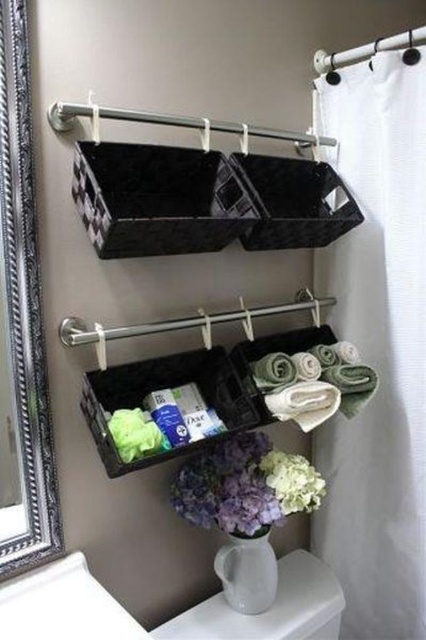
You are standing in the bathroom and want to reach the white fabric curtain at right to adjust it. However, there is a white glossy sink at lower left in your way. Which direction should you move to avoid the sink and reach the curtain?

Since the white fabric curtain at right is to the right of the white glossy sink at lower left, you should move to the right side of the sink to avoid it and reach the curtain.

You are a bathroom designer planning to install a new 30 inch wide decorative shelf between the white fabric curtain at right and the white glossy sink at lower left. Is there enough space to fit the shelf?

The distance between the white fabric curtain at right and the white glossy sink at lower left is 34.71 inches. Since the shelf is 30 inches wide, there is sufficient space to install it between them.